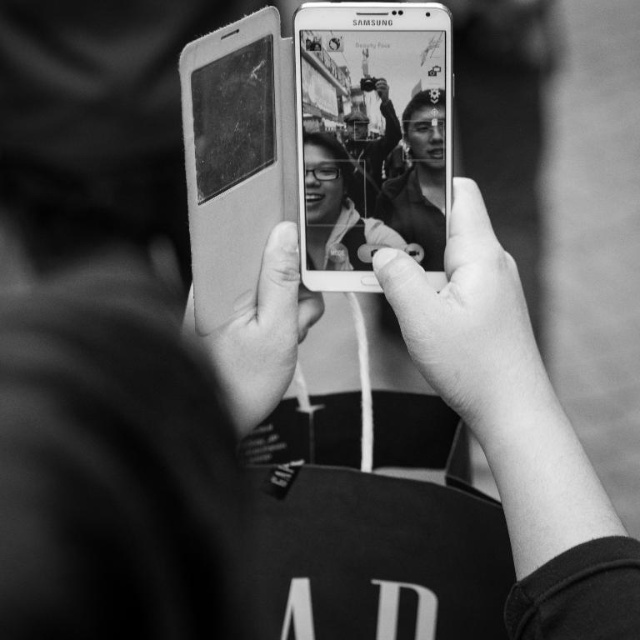
You are a photographer trying to frame a portrait. You notice two areas of smooth skin in the photo displayed on the Samsung smartphone screen. The first is labeled as smooth skin at center and the second as smooth skin hand at center. Which of these two areas appears larger in the photo?

The smooth skin at center is much taller than the smooth skin hand at center, making it appear larger in the photo.

You are a photographer trying to adjust the focus of your camera. You notice a point at coordinates (236, 157) on your viewfinder. Based on the scene described, what object is located at this point?

The point at coordinates (236, 157) corresponds to the leather like white smartphone at upper center.